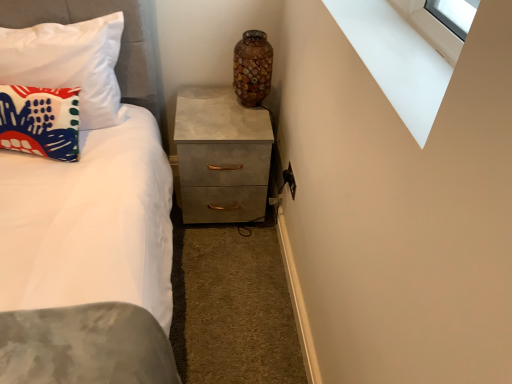
The image size is (512, 384). Identify the location of vacant space situated above white smooth window sill at upper right (from a real-world perspective). (393, 52).